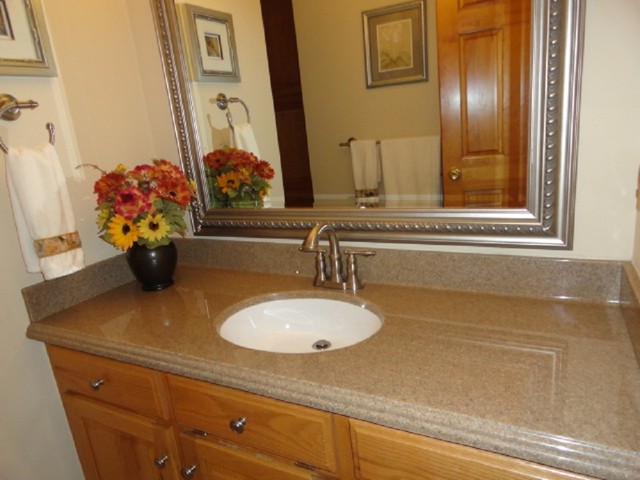
In order to click on picture frame in this screenshot , I will do `click(27, 49)`.